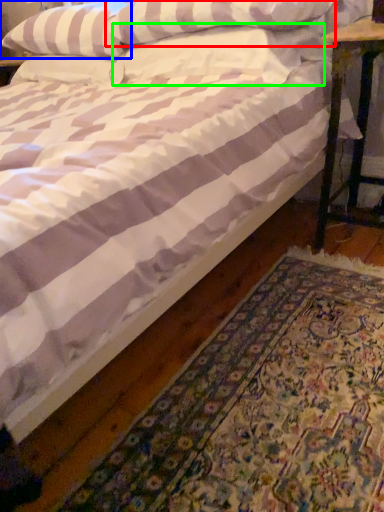
Question: Which is nearer to the pillow (highlighted by a red box)? pillow (highlighted by a blue box) or pillow (highlighted by a green box).

Choices:
 (A) pillow
 (B) pillow

Answer: (B)